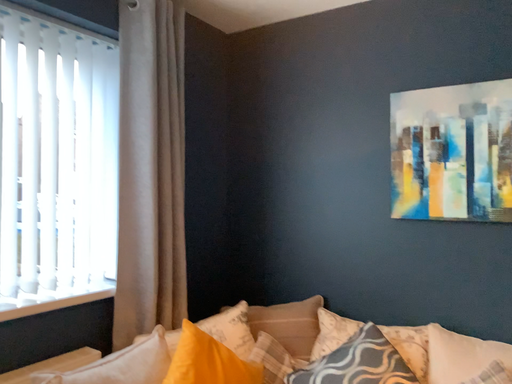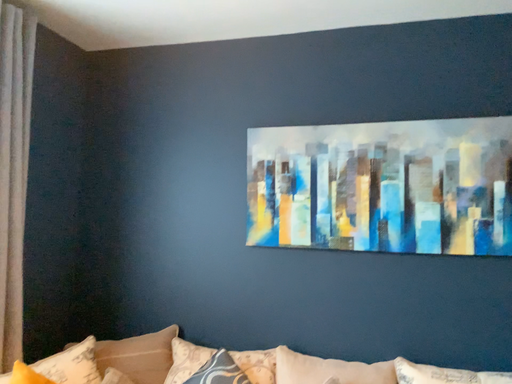
Question: Which way did the camera rotate in the video?

Choices:
 (A) rotated right
 (B) rotated left

Answer: (A)